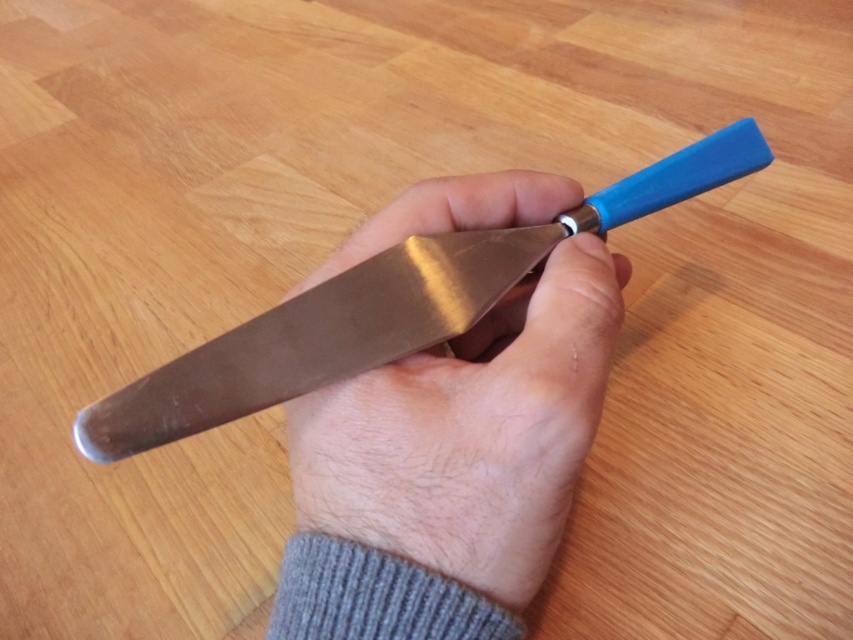
Can you confirm if metallic knife at center is positioned to the right of polished metal knife at center?

Incorrect, metallic knife at center is not on the right side of polished metal knife at center.

At what (x,y) coordinates should I click in order to perform the action: click on metallic knife at center. Please return your answer as a coordinate pair (x, y). Image resolution: width=853 pixels, height=640 pixels. Looking at the image, I should click on (469, 433).

Between point (492, 593) and point (276, 368), which one is positioned in front?

Positioned in front is point (492, 593).

Identify the location of metallic knife at center. This screenshot has width=853, height=640. (469, 433).